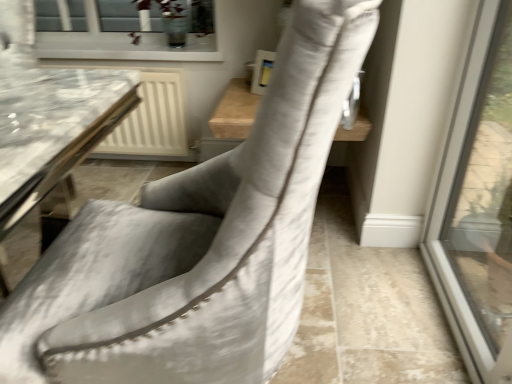
Question: From a real-world perspective, relative to suede-like gray chair at center, is green leafy plant at upper center vertically above or below?

Choices:
 (A) above
 (B) below

Answer: (A)

Question: Looking at their shapes, would you say green leafy plant at upper center is wider or thinner than suede-like gray chair at center?

Choices:
 (A) wide
 (B) thin

Answer: (B)

Question: Looking at the image, does green leafy plant at upper center seem bigger or smaller compared to suede-like gray chair at center?

Choices:
 (A) small
 (B) big

Answer: (A)

Question: Considering the positions of suede-like gray chair at center and green leafy plant at upper center in the image, is suede-like gray chair at center bigger or smaller than green leafy plant at upper center?

Choices:
 (A) small
 (B) big

Answer: (B)

Question: In terms of width, does suede-like gray chair at center look wider or thinner when compared to green leafy plant at upper center?

Choices:
 (A) wide
 (B) thin

Answer: (A)

Question: Relative to green leafy plant at upper center, is suede-like gray chair at center in front or behind?

Choices:
 (A) front
 (B) behind

Answer: (A)

Question: Is suede-like gray chair at center taller or shorter than green leafy plant at upper center?

Choices:
 (A) short
 (B) tall

Answer: (B)